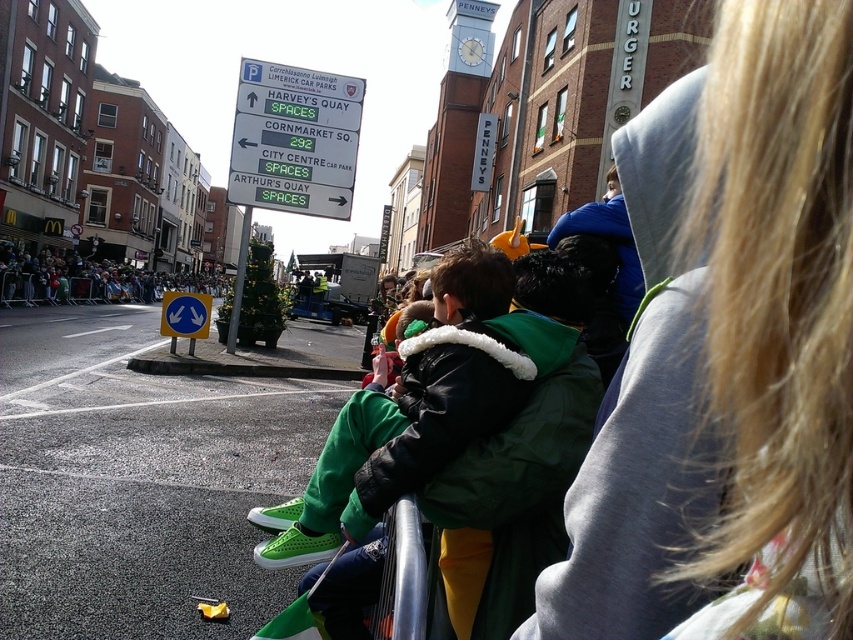
You are a photographer standing on the street and want to take a photo of the green fleece jacket at center and the signpost in the middle. How far apart are these two objects in inches?

The green fleece jacket at center and the signpost in the middle are 21.27 inches apart.

Looking at this image, you are a photographer trying to capture the entire scene of the green fabric crowd at left and the metallic silver rail at lower center in one shot. Based on their positions, which object should you position closer to the left side of your camera frame?

The green fabric crowd at left should be positioned closer to the left side of your camera frame since it is already located to the left of the metallic silver rail at lower center.

Consider the image. You are a delivery drone flying over the lively street scene. You need to deliver a package to the white plastic sign at upper left. However, there is a green fabric crowd at left nearby. Considering the distance between them, can you safely land the drone near the sign without getting too close to the crowd?

The white plastic sign at upper left is 16.87 meters away from the green fabric crowd at left. Since 16.87 meters is a safe distance, you can land the drone near the white plastic sign at upper left without worrying about the proximity to the green fabric crowd at left.